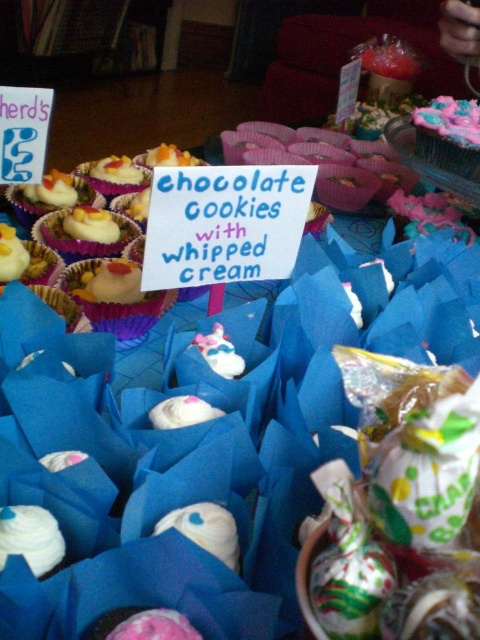
Is point (137, 259) positioned before point (64, 244)?

No.

Between white frosted cupcake at center and matte white cupcake at upper left, which one is positioned lower?

matte white cupcake at upper left is lower down.

The width and height of the screenshot is (480, 640). I want to click on white frosted cupcake at center, so click(107, 264).

Identify the location of white frosted cupcake at center. (107, 264).

Who is positioned more to the left, matte white cupcake at center or matte white cupcake at upper left?

matte white cupcake at upper left is more to the left.

Does matte white cupcake at center have a smaller size compared to matte white cupcake at upper left?

No.

Which is behind, point (96, 308) or point (86, 220)?

The point (86, 220) is more distant.

At what (x,y) coordinates should I click in order to perform the action: click on matte white cupcake at center. Please return your answer as a coordinate pair (x, y). This screenshot has height=640, width=480. Looking at the image, I should click on (115, 296).

Is white frosted cupcake at center positioned before matte white cupcake at center?

Yes, white frosted cupcake at center is in front of matte white cupcake at center.

Can you confirm if white frosted cupcake at center is thinner than matte white cupcake at center?

Incorrect, white frosted cupcake at center's width is not less than matte white cupcake at center's.

Is point (111, 321) behind point (98, 314)?

Yes, it is behind point (98, 314).

Where is `white frosted cupcake at center`? The height and width of the screenshot is (640, 480). white frosted cupcake at center is located at coordinates (107, 264).